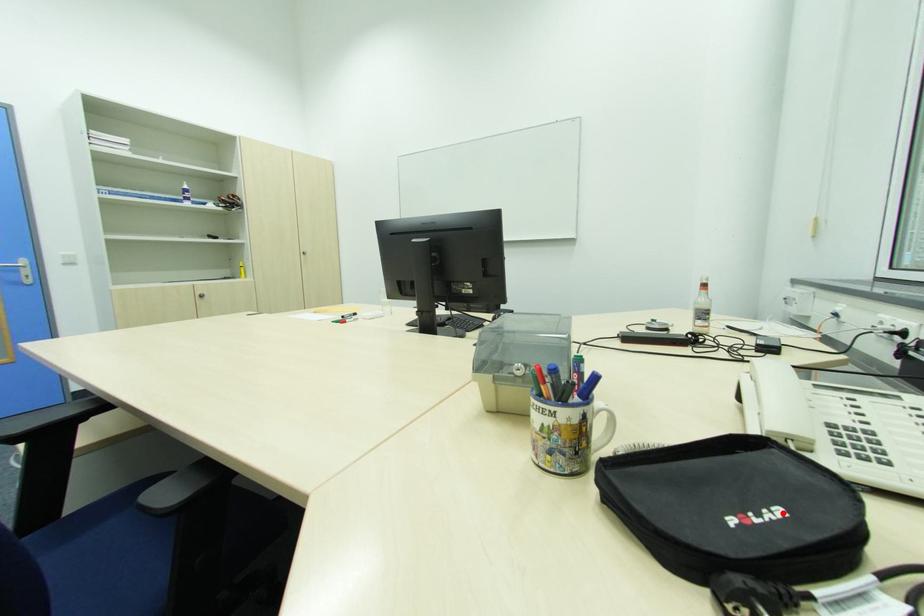
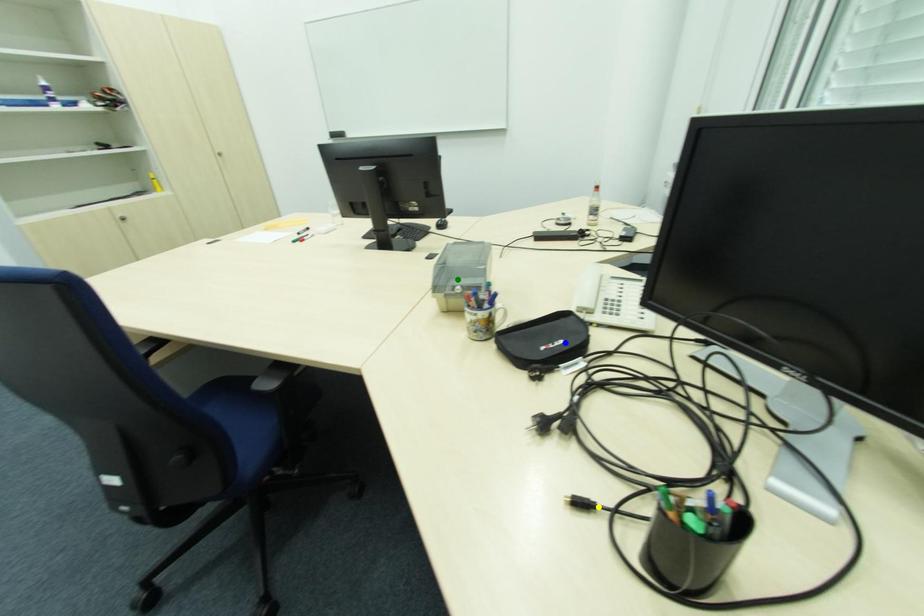
Question: I am providing you with two images of the same scene from different viewpoints. A red point is marked on the first image. You are given multiple points on the second image. In image 2, which mark is for the same physical point as the one in image 1?

Choices:
 (A) green point
 (B) blue point
 (C) yellow point

Answer: (B)